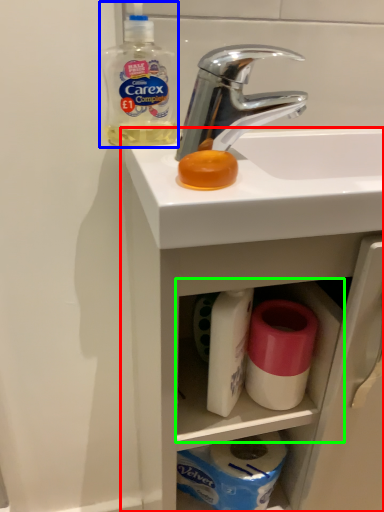
Question: Estimate the real-world distances between objects in this image. Which object is closer to bathroom cabinet (highlighted by a red box), cleaning product (highlighted by a blue box) or cabinet (highlighted by a green box)?

Choices:
 (A) cleaning product
 (B) cabinet

Answer: (B)